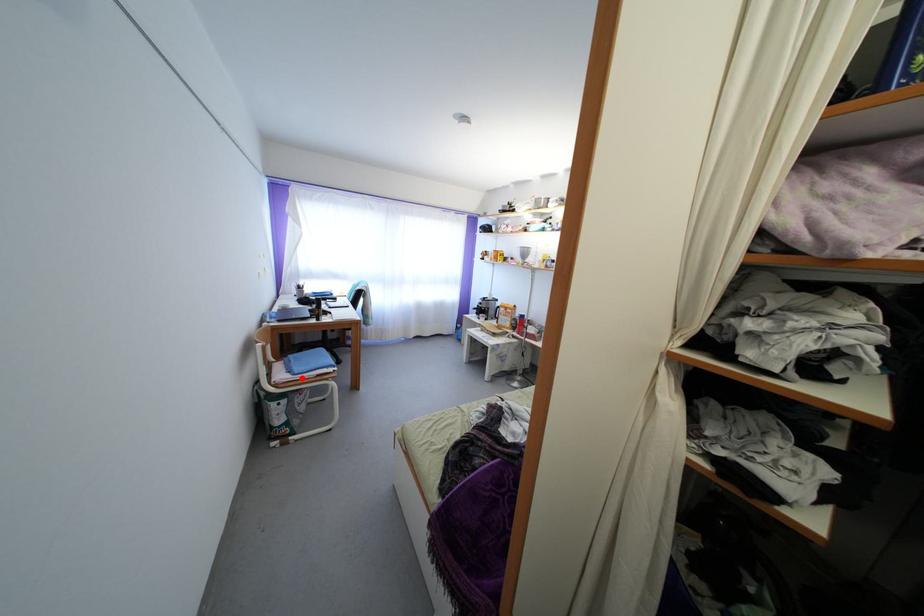
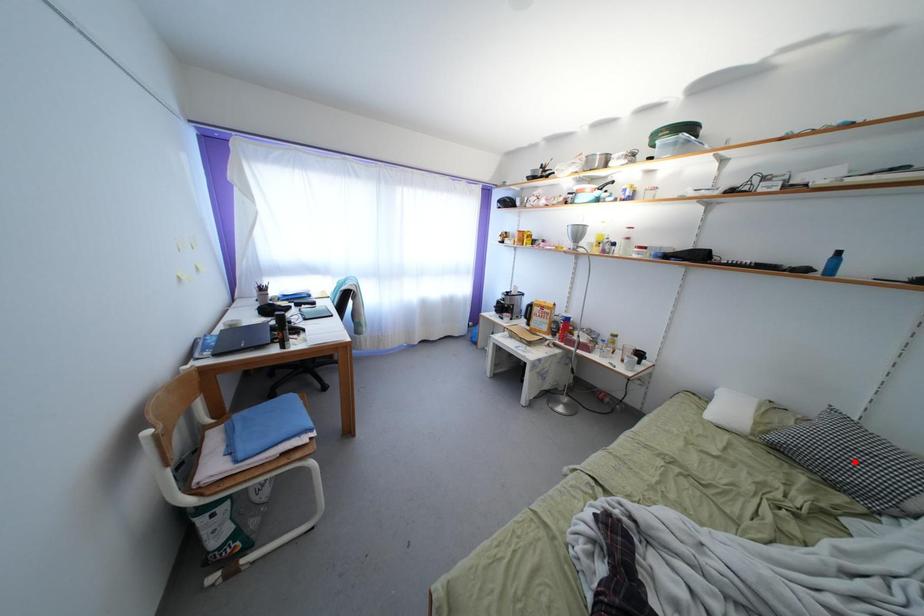
I am providing you with two images of the same scene from different viewpoints. A red point is marked on the first image and another point is marked on the second image. Do the highlighted points in image1 and image2 indicate the same real-world spot?

No